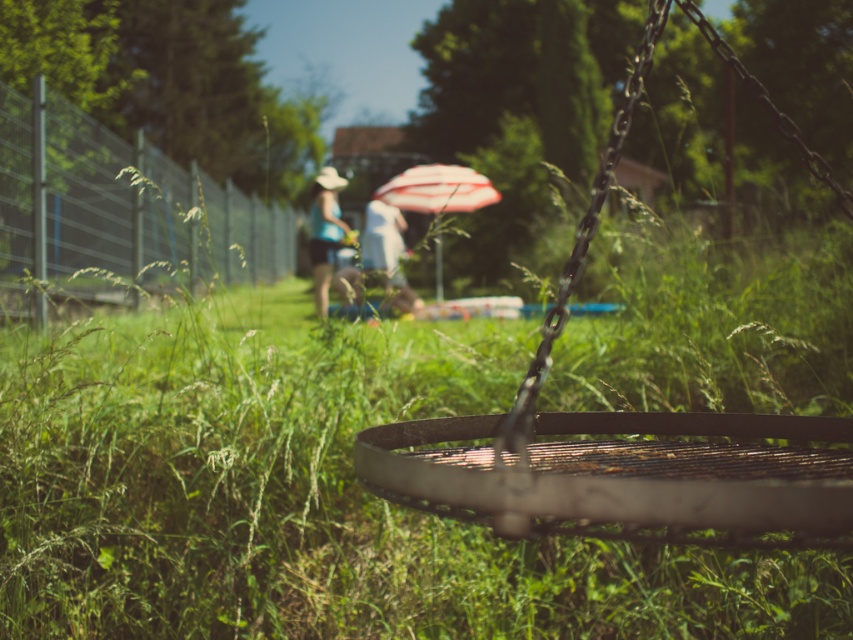
Can you confirm if metallic wire fence at left is bigger than matte blue shirt at center?

Indeed, metallic wire fence at left has a larger size compared to matte blue shirt at center.

Who is more distant from viewer, (80, 109) or (312, 212)?

The point (312, 212) is behind.

Where is `metallic wire fence at left`? This screenshot has width=853, height=640. metallic wire fence at left is located at coordinates (119, 205).

Does rusty metal swing at center have a lesser width compared to white fabric at center?

Incorrect, rusty metal swing at center's width is not less than white fabric at center's.

Is rusty metal swing at center shorter than white fabric at center?

Yes, rusty metal swing at center is shorter than white fabric at center.

Find the location of a particular element. This screenshot has height=640, width=853. rusty metal swing at center is located at coordinates (618, 445).

This screenshot has width=853, height=640. In order to click on rusty metal swing at center in this screenshot , I will do `click(618, 445)`.

Does metallic wire fence at left come in front of striped fabric umbrella at center?

Yes, it is.

Between metallic wire fence at left and striped fabric umbrella at center, which one is positioned higher?

striped fabric umbrella at center

Is point (242, 275) farther from camera compared to point (440, 172)?

Yes.

You are a GUI agent. You are given a task and a screenshot of the screen. Output one action in this format:
    pyautogui.click(x=<x>, y=<y>)
    Task: Click on the metallic wire fence at left
    This screenshot has width=853, height=640.
    Given the screenshot: What is the action you would take?
    pyautogui.click(x=119, y=205)